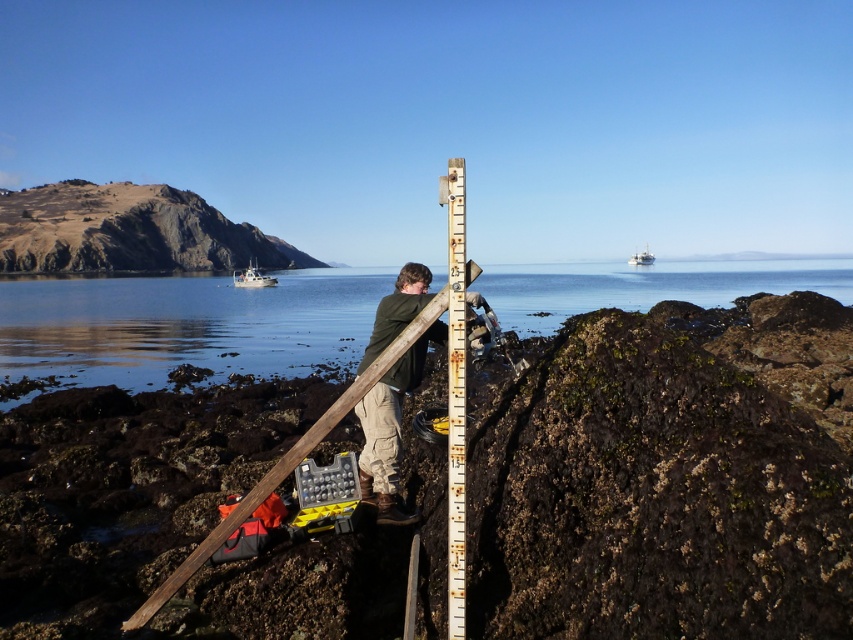
Question: Which object appears closest to the camera in this image?

Choices:
 (A) white plastic boat at center
 (B) clear water at center
 (C) brushed metal boat at center
 (D) green matte jacket at center

Answer: (D)

Question: Can you confirm if clear water at center is wider than rusty metal ruler at center?

Choices:
 (A) no
 (B) yes

Answer: (B)

Question: Estimate the real-world distances between objects in this image. Which object is closer to the white plastic boat at center?

Choices:
 (A) green matte jacket at center
 (B) clear water at center

Answer: (B)

Question: Does green matte jacket at center have a greater width compared to white plastic boat at center?

Choices:
 (A) yes
 (B) no

Answer: (B)

Question: Among these points, which one is nearest to the camera?

Choices:
 (A) (606, 300)
 (B) (463, 285)
 (C) (389, 465)

Answer: (B)

Question: Does clear water at center come in front of brushed metal boat at center?

Choices:
 (A) no
 (B) yes

Answer: (B)